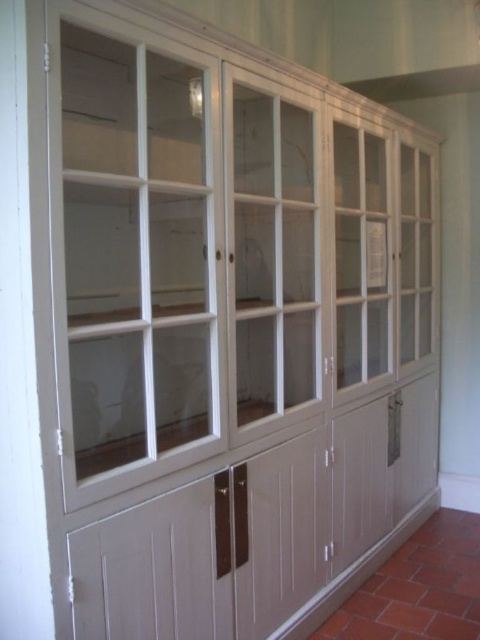
Question: Which of the following is the farthest from the observer?

Choices:
 (A) (200, 316)
 (B) (237, 90)

Answer: (B)

Question: Does clear glass cabinet at left appear on the right side of clear glass cabinet at center?

Choices:
 (A) yes
 (B) no

Answer: (B)

Question: Is clear glass cabinet at left above clear glass cabinet at center?

Choices:
 (A) no
 (B) yes

Answer: (A)

Question: In this image, where is clear glass cabinet at left located relative to clear glass cabinet at center?

Choices:
 (A) above
 (B) below

Answer: (B)